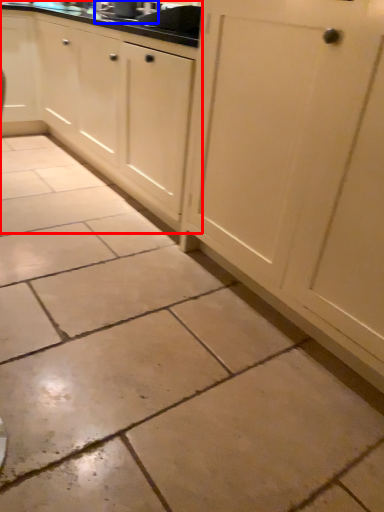
Question: Among these objects, which one is nearest to the camera, cabinetry (highlighted by a red box) or sink (highlighted by a blue box)?

Choices:
 (A) cabinetry
 (B) sink

Answer: (A)